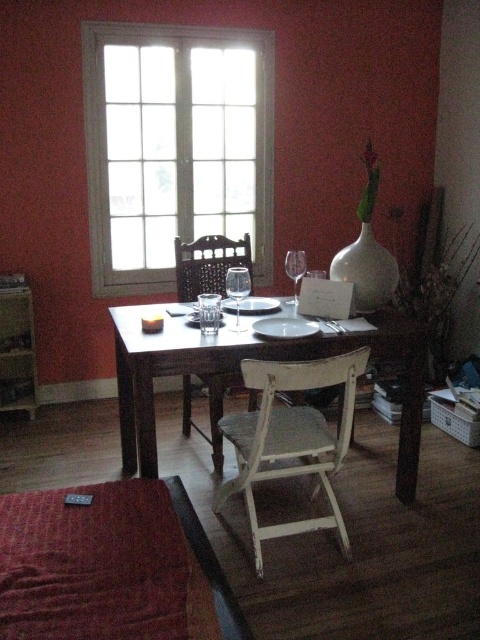
You are standing in the dining area and want to move closer to the woven wood chair at center. If your current position is 2 meters away from the chair, how many more meters do you need to walk to reach it?

Result: The distance between the woven wood chair at center and the camera is 3.11 meters. Since you are currently 2 meters away, you need to walk an additional 1.11 meters to reach the chair.

From the picture: You are sitting at the dining table and want to reach the transparent glass wine glass at table center. If your arm can extend 2 meters, can you comfortably reach it?

The transparent glass wine glass at table center is 7.76 feet away from the viewer. Since 7.76 feet is approximately 2.36 meters, which is slightly longer than your arm extension of 2 meters, you might not be able to comfortably reach it without moving closer.